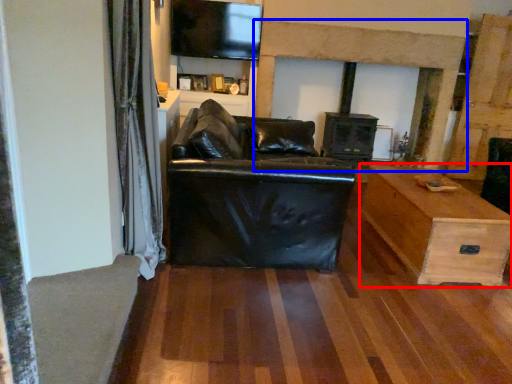
Question: Which point is closer to the camera, table (highlighted by a red box) or fireplace (highlighted by a blue box)?

Choices:
 (A) table
 (B) fireplace

Answer: (A)